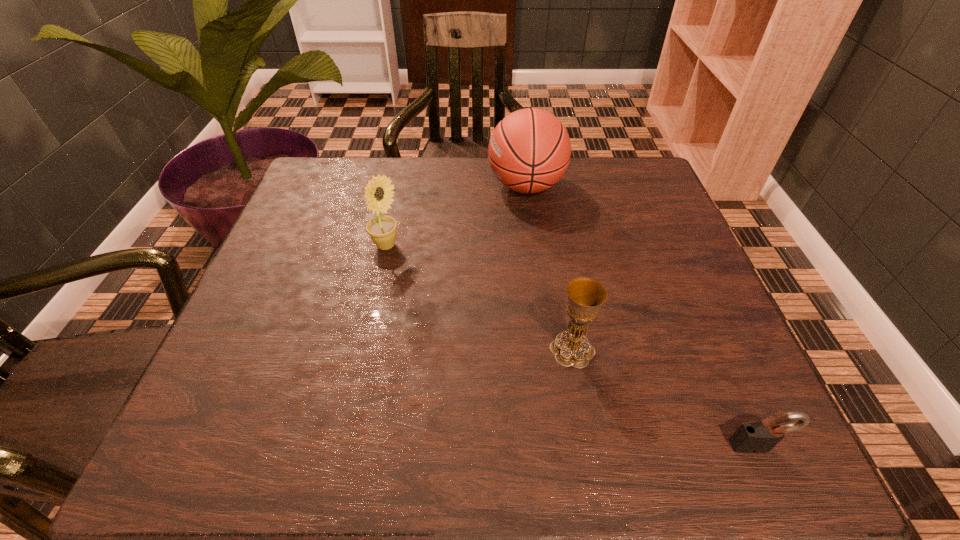
This screenshot has width=960, height=540. In the image, there is a desktop. In order to click on vacant region at the far right corner in this screenshot , I will do `click(653, 208)`.

This screenshot has height=540, width=960. Find the location of `free space between the farthest object and the third nearest object`. free space between the farthest object and the third nearest object is located at coordinates (456, 216).

You are a GUI agent. You are given a task and a screenshot of the screen. Output one action in this format:
    pyautogui.click(x=<x>, y=<y>)
    Task: Click on the unoccupied area between the basketball and the leftmost object
    
    Given the screenshot: What is the action you would take?
    pyautogui.click(x=456, y=216)

The width and height of the screenshot is (960, 540). What are the coordinates of `free point between the shortest object and the basketball` in the screenshot? It's located at (641, 316).

Where is `vacant area between the second farthest object and the basketball`? Image resolution: width=960 pixels, height=540 pixels. vacant area between the second farthest object and the basketball is located at coordinates (456, 216).

Where is `free spot between the basketball and the third nearest object`? This screenshot has height=540, width=960. free spot between the basketball and the third nearest object is located at coordinates (456, 216).

Where is `vacant space in between the chalice and the leftmost object`? The height and width of the screenshot is (540, 960). vacant space in between the chalice and the leftmost object is located at coordinates point(479,298).

Locate an element on the screen. The width and height of the screenshot is (960, 540). free spot between the second farthest object and the farthest object is located at coordinates (456, 216).

This screenshot has height=540, width=960. Find the location of `free spot between the second nearest object and the farthest object`. free spot between the second nearest object and the farthest object is located at coordinates (549, 268).

Where is `free spot between the farthest object and the chalice`? The height and width of the screenshot is (540, 960). free spot between the farthest object and the chalice is located at coordinates (549, 268).